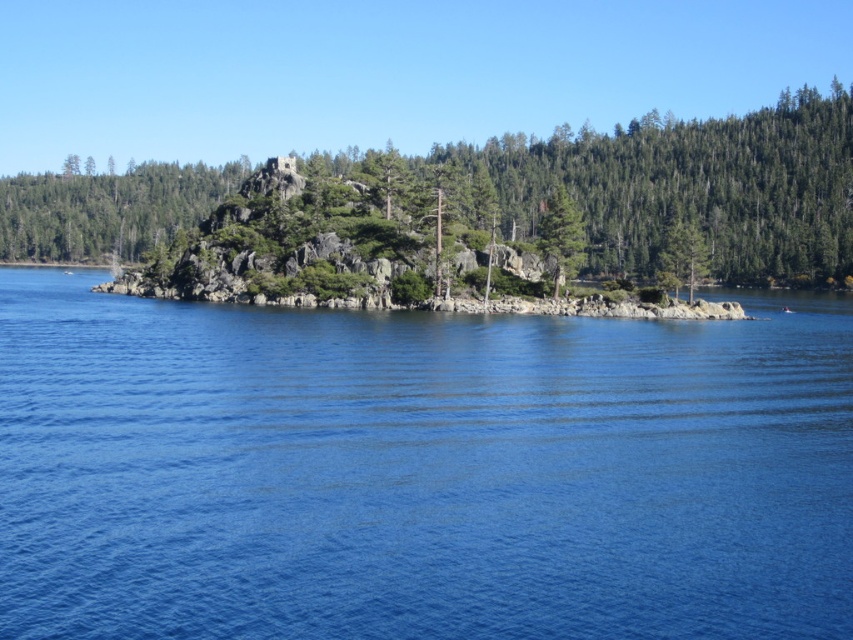
You are standing at the edge of the water and see two green matte trees in the distance. Which tree, the green matte tree at center or the green matte tree at upper center, is closer to you?

The green matte tree at center is closer to the viewer than the green matte tree at upper center.

You are an environmental scientist analyzing the spatial distribution of trees in the image. You observe the green matte tree at center and the green matte tree at upper center. Which tree takes up more area in the image?

The green matte tree at upper center takes up more area than the green matte tree at center because the green matte tree at center occupies less space than green matte tree at upper center.